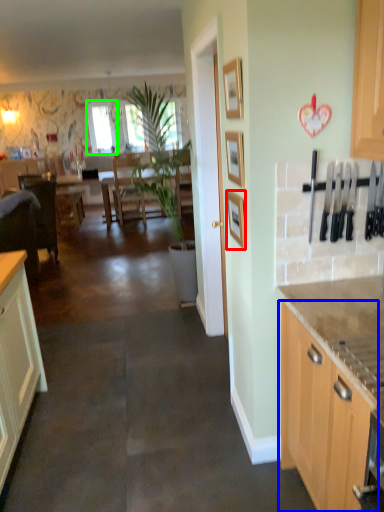
Question: Based on their relative distances, which object is farther from picture frame (highlighted by a red box)? Choose from cabinetry (highlighted by a blue box) and window screen (highlighted by a green box).

Choices:
 (A) cabinetry
 (B) window screen

Answer: (B)